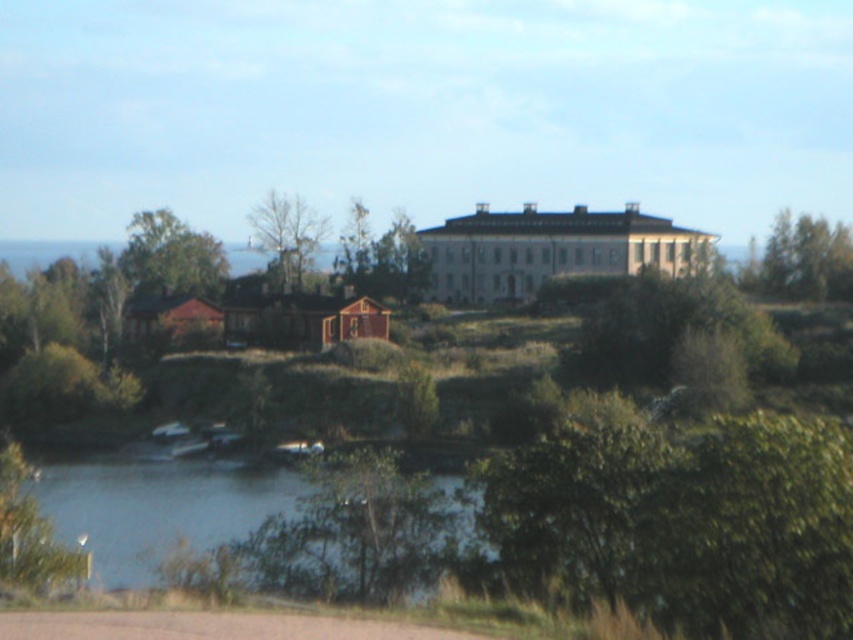
Consider the image. Which is below, green leafy tree at upper left or bare wood tree at center?

green leafy tree at upper left is below.

Can you confirm if green leafy tree at upper left is positioned above bare wood tree at center?

Incorrect, green leafy tree at upper left is not positioned above bare wood tree at center.

Between point (196, 282) and point (292, 285), which one is positioned in front?

Positioned in front is point (292, 285).

Identify the location of green leafy tree at upper left. The height and width of the screenshot is (640, 853). (171, 257).

Does point (198, 269) come in front of point (33, 525)?

That is False.

Who is higher up, green leafy tree at upper left or green leafy tree at lower left?

green leafy tree at upper left is above.

Is point (144, 252) closer to viewer compared to point (1, 458)?

No, it is not.

Where is `green leafy tree at upper left`? green leafy tree at upper left is located at coordinates pos(171,257).

Is clear water at lower left closer to camera compared to green leafy tree at upper left?

Yes, clear water at lower left is in front of green leafy tree at upper left.

Is point (170, 529) farther from camera compared to point (163, 228)?

No.

Is point (277, 506) positioned behind point (199, 260)?

No.

The height and width of the screenshot is (640, 853). Identify the location of clear water at lower left. (155, 506).